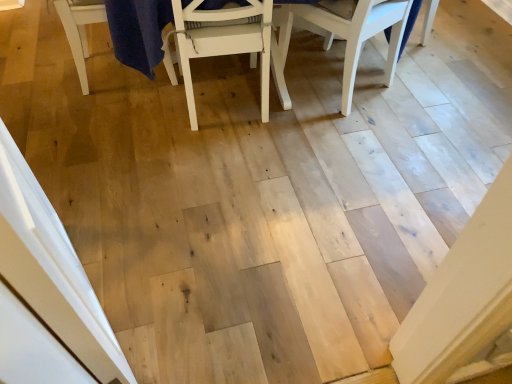
Question: Is point (350, 102) positioned closer to the camera than point (200, 29)?

Choices:
 (A) closer
 (B) farther

Answer: (B)

Question: In terms of height, does white wood chair at upper right, which is the first chair in right-to-left order, look taller or shorter compared to white matte chair at center, placed as the 2th chair when sorted from right to left?

Choices:
 (A) tall
 (B) short

Answer: (B)

Question: From a real-world perspective, is white wood chair at upper right, marked as the 2th chair in a left-to-right arrangement, physically located above or below white matte chair at center, which is the first chair from left to right?

Choices:
 (A) below
 (B) above

Answer: (A)

Question: Considering their positions, is white matte chair at center, which is the first chair from left to right, located in front of or behind white wood chair at upper right, which is the first chair in right-to-left order?

Choices:
 (A) front
 (B) behind

Answer: (A)

Question: Is white matte chair at center, placed as the 2th chair when sorted from right to left, taller or shorter than white wood chair at upper right, which is the first chair in right-to-left order?

Choices:
 (A) tall
 (B) short

Answer: (A)

Question: Is white matte chair at center, placed as the 2th chair when sorted from right to left, inside the boundaries of white wood chair at upper right, marked as the 2th chair in a left-to-right arrangement, or outside?

Choices:
 (A) outside
 (B) inside

Answer: (A)

Question: Considering the positions of white matte chair at center, which is the first chair from left to right, and white wood chair at upper right, which is the first chair in right-to-left order, in the image, is white matte chair at center, which is the first chair from left to right, wider or thinner than white wood chair at upper right, which is the first chair in right-to-left order,?

Choices:
 (A) thin
 (B) wide

Answer: (B)